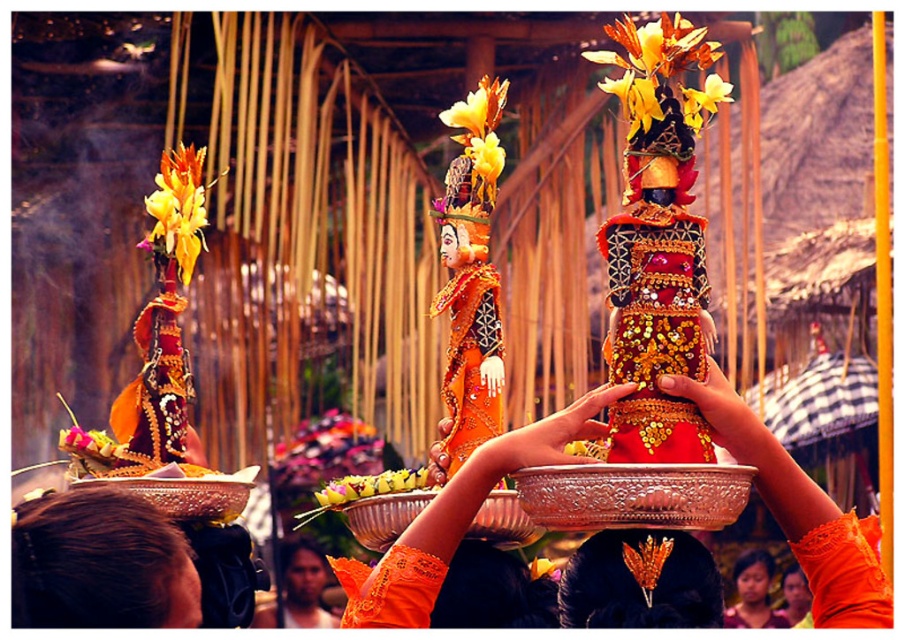
Question: Is gold leaf headpiece at center further to the viewer compared to matte orange head at center?

Choices:
 (A) no
 (B) yes

Answer: (A)

Question: Which is farther from the shiny orange fabric at center?

Choices:
 (A) yellow fabric flower at center
 (B) brown hair at center

Answer: (B)

Question: Which of the following is the closest to the observer?

Choices:
 (A) (546, 456)
 (B) (589, 605)
 (C) (497, 172)

Answer: (A)

Question: Estimate the real-world distances between objects in this image. Which object is closer to the yellow matte flowers at center?

Choices:
 (A) brown hair at center
 (B) smooth gold bracelet at center
 (C) smooth brown hair at center

Answer: (B)

Question: In this image, where is yellow matte flowers at center located relative to yellow fabric flower at center?

Choices:
 (A) right
 (B) left

Answer: (A)

Question: Does shiny orange headdress at center have a greater width compared to yellow fabric flower at center?

Choices:
 (A) no
 (B) yes

Answer: (B)